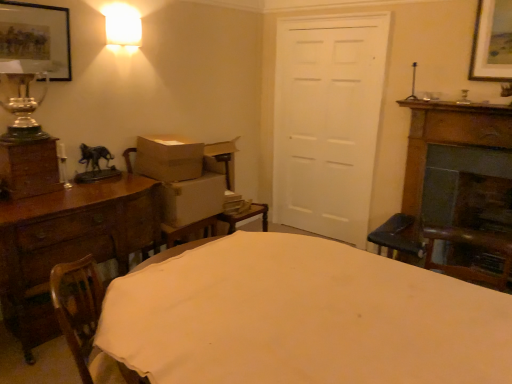
Locate an element on the screen. free point above wooden fireplace at right (from a real-world perspective) is located at coordinates (466, 117).